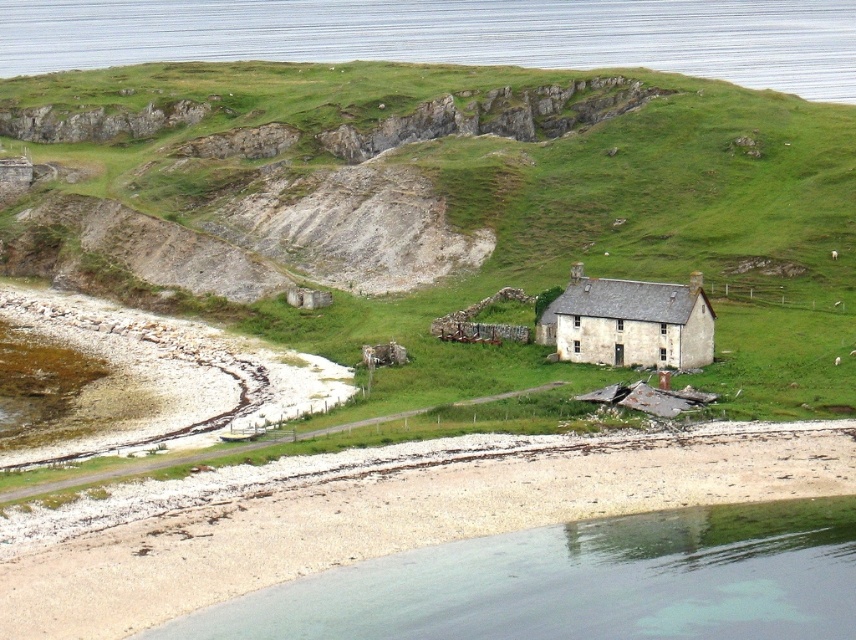
Question: Which object is closer to the camera taking this photo?

Choices:
 (A) green grass at upper center
 (B) weathered stone cottage at center
 (C) green grassy hillside at center

Answer: (C)

Question: Is smooth sand beach at lower left further to the viewer compared to weathered stone cottage at center?

Choices:
 (A) yes
 (B) no

Answer: (B)

Question: Among these objects, which one is nearest to the camera?

Choices:
 (A) weathered stone cottage at center
 (B) green grass at upper center
 (C) green grassy hillside at center
 (D) smooth sand beach at lower left

Answer: (D)

Question: Can you confirm if green grass at upper center is positioned to the right of weathered stone cottage at center?

Choices:
 (A) no
 (B) yes

Answer: (A)

Question: Which of the following is the closest to the observer?

Choices:
 (A) green grassy hillside at center
 (B) weathered stone cottage at center
 (C) smooth sand beach at lower left
 (D) green grass at upper center

Answer: (C)

Question: Does green grassy hillside at center have a lesser width compared to smooth sand beach at lower left?

Choices:
 (A) no
 (B) yes

Answer: (A)